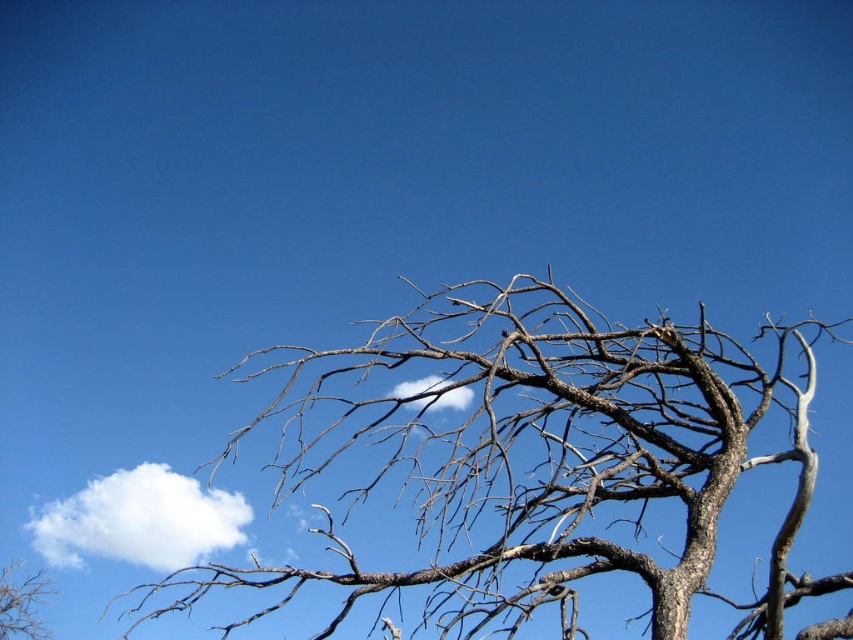
Is point (219, 506) in front of point (21, 634)?

Yes, point (219, 506) is in front of point (21, 634).

In order to click on white fluffy cloud at upper left in this screenshot , I will do `click(138, 520)`.

Does point (154, 566) lie in front of point (4, 576)?

That is True.

Find the location of a particular element. The height and width of the screenshot is (640, 853). white fluffy cloud at upper left is located at coordinates (138, 520).

Between point (695, 572) and point (18, 588), which one is positioned behind?

The point (18, 588) is more distant.

Is brown rough tree at center wider than brown rough tree at lower left?

Yes.

Find the location of a particular element. brown rough tree at center is located at coordinates (531, 458).

Can you confirm if white fluffy cloud at upper left is smaller than white fluffy cloud at center?

Actually, white fluffy cloud at upper left might be larger than white fluffy cloud at center.

The width and height of the screenshot is (853, 640). Find the location of `white fluffy cloud at upper left`. white fluffy cloud at upper left is located at coordinates (138, 520).